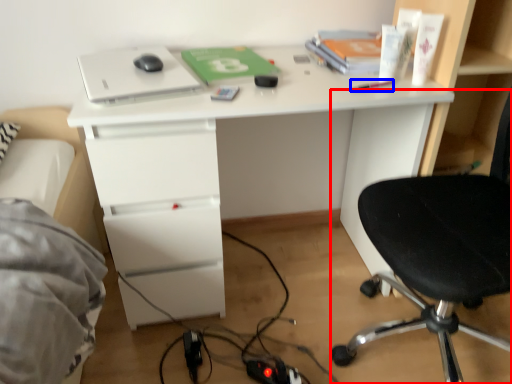
Question: Which of the following is the closest to the observer, chair (highlighted by a red box) or stationery (highlighted by a blue box)?

Choices:
 (A) chair
 (B) stationery

Answer: (A)